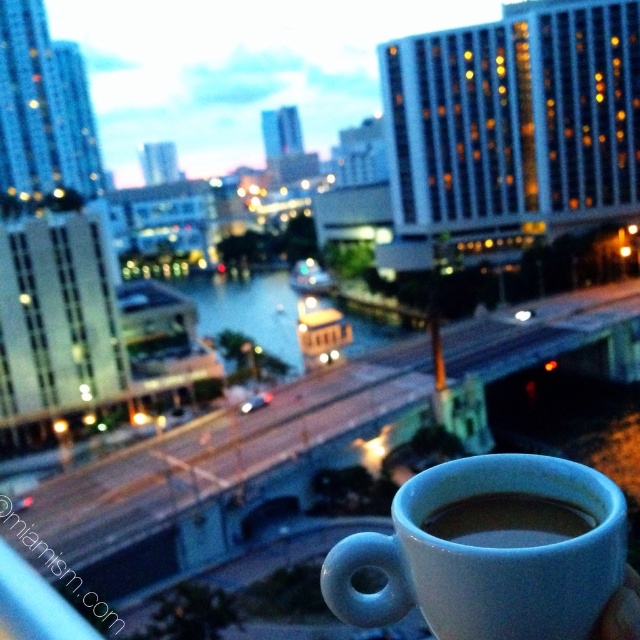
You are standing on a balcony and want to place the matte ceramic mug at lower right on a shelf that is 1 meter away from the edge. Given its current position at point 0.863 on the x and 0.767 on the y axis, can you estimate if it will fit without falling off the edge?

The matte ceramic mug at lower right is located at point 0.867 on the x and 0.767 on the y axis, so it will fit on the shelf 1 meter away from the edge as it is positioned within the safe area.

You are standing on a balcony looking at the cityscape. There are two points marked in the image. One is at coordinates point [624,572] and the other is at point [582,525]. Which point is closer to your eyes?

Point [624,572] is closer to the camera than point [582,525].